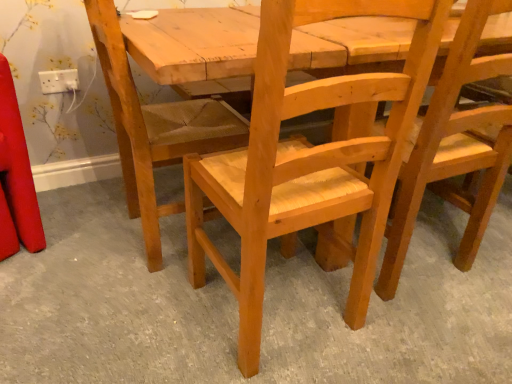
Locate an element on the screen. The width and height of the screenshot is (512, 384). free space that is to the left of natural wood chair at center, the third chair positioned from the right is located at coordinates (79, 232).